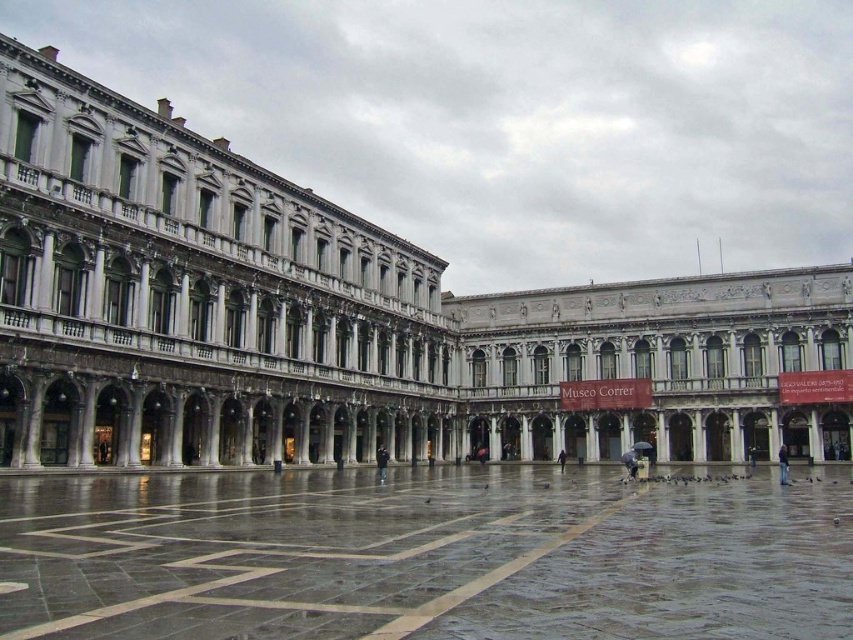
You are standing in the grand piazza in Venice. You see a dark blue jacket at center. Where exactly is the dark blue jacket located in terms of coordinates?

The dark blue jacket at center is located at coordinates point (381, 464).

You are standing in the piazza and need to walk from the marble floor at center to the dark gray fabric jacket at lower right. Which direction should you move to reach the jacket?

To reach the dark gray fabric jacket at lower right from the marble floor at center, you should move to the right since the marble floor at center is positioned on the left side of the jacket.